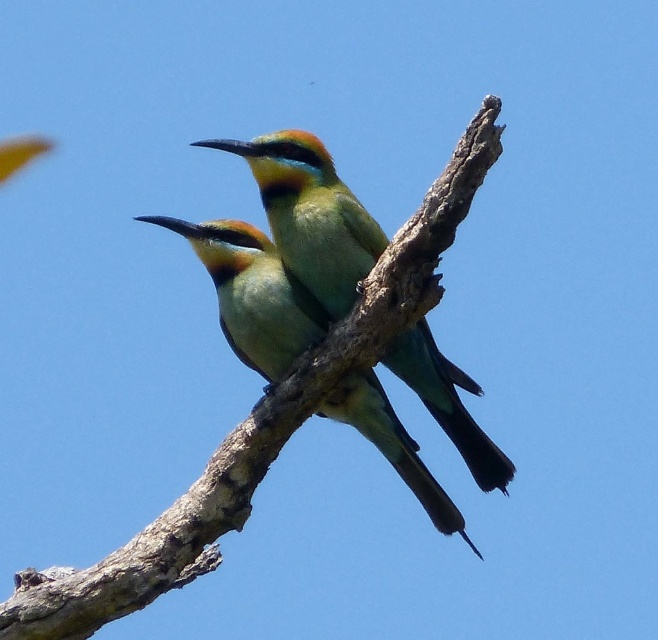
Can you confirm if brown rough branch at center is smaller than green glossy bee-eater at center?

Actually, brown rough branch at center might be larger than green glossy bee-eater at center.

Which is in front, point (211, 460) or point (263, 148)?

Positioned in front is point (263, 148).

At what (x,y) coordinates should I click in order to perform the action: click on brown rough branch at center. Please return your answer as a coordinate pair (x, y). This screenshot has width=658, height=640. Looking at the image, I should click on (268, 413).